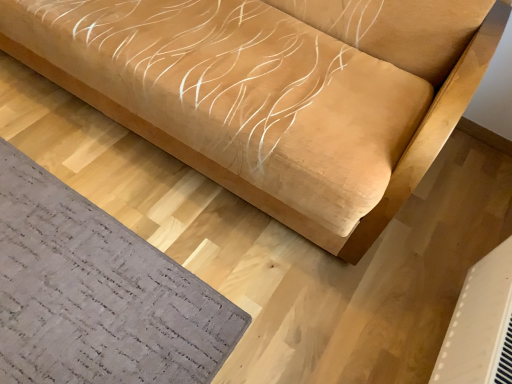
The height and width of the screenshot is (384, 512). What do you see at coordinates (276, 92) in the screenshot?
I see `suede-like beige sofa at upper center` at bounding box center [276, 92].

What is the approximate height of white plastic air conditioning unit at lower right?

The height of white plastic air conditioning unit at lower right is 11.90 inches.

This screenshot has width=512, height=384. I want to click on gray textured mat at lower left, so click(97, 294).

I want to click on suede-like beige sofa at upper center, so click(276, 92).

Is point (186, 382) farther from camera compared to point (165, 31)?

That is False.

Can you confirm if gray textured mat at lower left is positioned to the right of suede-like beige sofa at upper center?

No, gray textured mat at lower left is not to the right of suede-like beige sofa at upper center.

Is gray textured mat at lower left not close to suede-like beige sofa at upper center?

That's not correct — gray textured mat at lower left is a little close to suede-like beige sofa at upper center.

From the image's perspective, is gray textured mat at lower left above suede-like beige sofa at upper center?

No, from the image's perspective, gray textured mat at lower left is not over suede-like beige sofa at upper center.

Is white plastic air conditioning unit at lower right to the left of gray textured mat at lower left from the viewer's perspective?

No, white plastic air conditioning unit at lower right is not to the left of gray textured mat at lower left.

From a real-world perspective, who is located lower, white plastic air conditioning unit at lower right or gray textured mat at lower left?

gray textured mat at lower left.

Locate an element on the screen. The image size is (512, 384). air conditioning below the gray textured mat at lower left (from the image's perspective) is located at coordinates (480, 325).

Which is in front, point (445, 383) or point (136, 271)?

The point (445, 383) is in front.

Consider the image. Between suede-like beige sofa at upper center and gray textured mat at lower left, which one is positioned in front?

suede-like beige sofa at upper center.

Looking at the image, does suede-like beige sofa at upper center seem bigger or smaller compared to gray textured mat at lower left?

Clearly, suede-like beige sofa at upper center is larger in size than gray textured mat at lower left.

This screenshot has width=512, height=384. What are the coordinates of `mat behind the suede-like beige sofa at upper center` in the screenshot? It's located at (97, 294).

Is gray textured mat at lower left facing away from white plastic air conditioning unit at lower right?

gray textured mat at lower left does not have its back to white plastic air conditioning unit at lower right.

Between point (44, 170) and point (502, 265), which one is positioned in front?

Point (502, 265)

Which object is closer to the camera, gray textured mat at lower left or white plastic air conditioning unit at lower right?

white plastic air conditioning unit at lower right.

You are a GUI agent. You are given a task and a screenshot of the screen. Output one action in this format:
    pyautogui.click(x=<x>, y=<y>)
    Task: Click on the furniture above the white plastic air conditioning unit at lower right (from the image's perspective)
    Image resolution: width=512 pixels, height=384 pixels.
    Given the screenshot: What is the action you would take?
    pyautogui.click(x=276, y=92)

Does point (326, 115) appear closer or farther from the camera than point (466, 310)?

Point (326, 115) appears to be closer to the viewer than point (466, 310).

Considering the sizes of objects suede-like beige sofa at upper center and white plastic air conditioning unit at lower right in the image provided, who is bigger, suede-like beige sofa at upper center or white plastic air conditioning unit at lower right?

Bigger between the two is suede-like beige sofa at upper center.

Consider the image. Is suede-like beige sofa at upper center turned away from white plastic air conditioning unit at lower right?

That's not correct — suede-like beige sofa at upper center is not looking away from white plastic air conditioning unit at lower right.

Based on the photo, is white plastic air conditioning unit at lower right shorter than suede-like beige sofa at upper center?

Indeed, white plastic air conditioning unit at lower right has a lesser height compared to suede-like beige sofa at upper center.

From the image's perspective, does white plastic air conditioning unit at lower right appear lower than suede-like beige sofa at upper center?

Indeed, from the image's perspective, white plastic air conditioning unit at lower right is shown beneath suede-like beige sofa at upper center.

How distant is white plastic air conditioning unit at lower right from suede-like beige sofa at upper center?

white plastic air conditioning unit at lower right and suede-like beige sofa at upper center are 25.75 inches apart.

Find the location of a particular element. Image resolution: width=512 pixels, height=384 pixels. furniture on the right side of gray textured mat at lower left is located at coordinates (276, 92).

Locate an element on the screen. Image resolution: width=512 pixels, height=384 pixels. mat above the white plastic air conditioning unit at lower right (from the image's perspective) is located at coordinates (97, 294).

From the picture: Based on their spatial positions, is gray textured mat at lower left or suede-like beige sofa at upper center further from white plastic air conditioning unit at lower right?

gray textured mat at lower left.

Based on their spatial positions, is suede-like beige sofa at upper center or white plastic air conditioning unit at lower right further from gray textured mat at lower left?

white plastic air conditioning unit at lower right lies further to gray textured mat at lower left than the other object.

Which object lies further to the anchor point suede-like beige sofa at upper center, gray textured mat at lower left or white plastic air conditioning unit at lower right?

white plastic air conditioning unit at lower right is positioned further to the anchor suede-like beige sofa at upper center.

Based on their spatial positions, is white plastic air conditioning unit at lower right or gray textured mat at lower left further from suede-like beige sofa at upper center?

Based on the image, white plastic air conditioning unit at lower right appears to be further to suede-like beige sofa at upper center.

Considering their positions, is white plastic air conditioning unit at lower right positioned further to gray textured mat at lower left than suede-like beige sofa at upper center?

Based on the image, white plastic air conditioning unit at lower right appears to be further to gray textured mat at lower left.

Considering their positions, is suede-like beige sofa at upper center positioned closer to white plastic air conditioning unit at lower right than gray textured mat at lower left?

suede-like beige sofa at upper center is closer to white plastic air conditioning unit at lower right.

Image resolution: width=512 pixels, height=384 pixels. In order to click on mat between suede-like beige sofa at upper center and white plastic air conditioning unit at lower right in the vertical direction in this screenshot , I will do `click(97, 294)`.